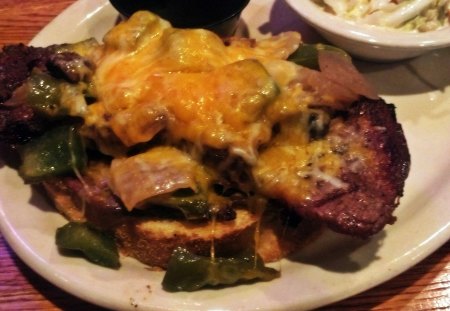
In order to click on round white plate in this screenshot , I will do `click(384, 268)`, `click(23, 220)`, `click(81, 18)`.